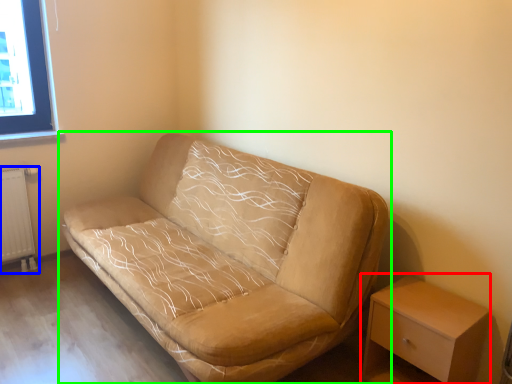
Question: Which object is the closest to the table (highlighted by a red box)? Choose among these: radiator (highlighted by a blue box) or studio couch (highlighted by a green box).

Choices:
 (A) radiator
 (B) studio couch

Answer: (B)